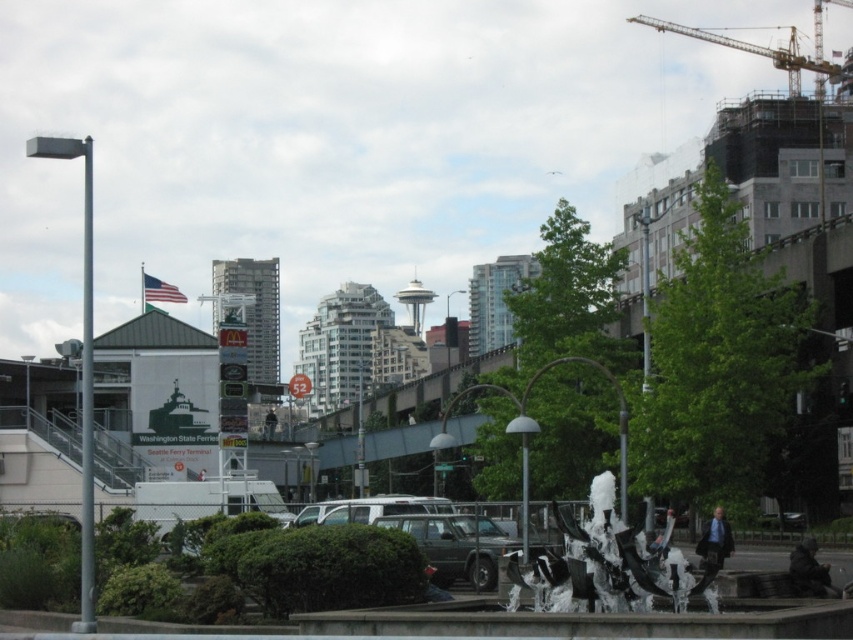
Question: Estimate the real-world distances between objects in this image. Which object is farther from the white frothy sculpture at center?

Choices:
 (A) metallic gray suv at center
 (B) metallic construction crane at upper right

Answer: (B)

Question: Observing the image, what is the correct spatial positioning of white frothy sculpture at center in reference to metallic gray suv at center?

Choices:
 (A) left
 (B) right

Answer: (B)

Question: Can you confirm if metallic gray suv at center is bigger than metallic construction crane at upper right?

Choices:
 (A) yes
 (B) no

Answer: (B)

Question: Which object is the closest to the metallic construction crane at upper right?

Choices:
 (A) metallic gray suv at center
 (B) white frothy sculpture at center

Answer: (A)

Question: Which object is the closest to the metallic gray suv at center?

Choices:
 (A) metallic construction crane at upper right
 (B) white frothy sculpture at center

Answer: (B)

Question: Does white frothy sculpture at center have a smaller size compared to metallic gray suv at center?

Choices:
 (A) yes
 (B) no

Answer: (B)